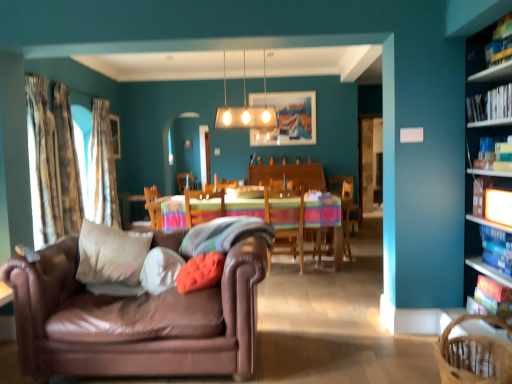
Measure the distance between white soft cushion at center, which is the 1th pillow from left to right, and camera.

white soft cushion at center, which is the 1th pillow from left to right, and camera are 2.65 meters apart.

Image resolution: width=512 pixels, height=384 pixels. In order to click on wooden chair at center, positioned as the 1th chair in left-to-right order in this screenshot , I will do coord(203,198).

The height and width of the screenshot is (384, 512). What do you see at coordinates (500, 41) in the screenshot?
I see `hardcover book at upper right, the fifth book when ordered from bottom to top` at bounding box center [500, 41].

What are the coordinates of `leather couch at left` in the screenshot? It's located at click(x=135, y=319).

From the image's perspective, relative to hardcover book at right, which appears as the 1th book when ordered from the bottom, is wooden chair at center, positioned as the 1th chair in left-to-right order, above or below?

wooden chair at center, positioned as the 1th chair in left-to-right order, is situated higher than hardcover book at right, which appears as the 1th book when ordered from the bottom, in the image.

Visually, is wooden chair at center, positioned as the 1th chair in left-to-right order, positioned to the left or to the right of hardcover book at right, the fifth book when ordered from top to bottom?

wooden chair at center, positioned as the 1th chair in left-to-right order, is positioned on hardcover book at right, the fifth book when ordered from top to bottom,'s left side.

Is the surface of wooden chair at center, positioned as the 1th chair in left-to-right order, in direct contact with hardcover book at right, the fifth book when ordered from top to bottom?

They are not placed beside each other.

In the image, is wooden table with striped cloth at center on the left side or the right side of white glossy rectangular light fixture at upper center?

wooden table with striped cloth at center is to the right of white glossy rectangular light fixture at upper center.

The image size is (512, 384). I want to click on kitchen & dining room table in front of the white glossy rectangular light fixture at upper center, so click(326, 220).

Who is taller, wooden table with striped cloth at center or white glossy rectangular light fixture at upper center?

white glossy rectangular light fixture at upper center.

Which is behind, point (308, 199) or point (273, 111)?

Point (273, 111)

From the image's perspective, would you say hardcover book at right, which appears as the 1th book when ordered from the bottom, is positioned over textured beige curtain at left, the 1th curtain viewed from the front?

No, from the image's perspective, hardcover book at right, which appears as the 1th book when ordered from the bottom, is not over textured beige curtain at left, the 1th curtain viewed from the front.

The height and width of the screenshot is (384, 512). There is a textured beige curtain at left, the 1th curtain viewed from the front. In order to click on the 3rd book below it (from a real-world perspective) in this screenshot , I will do `click(493, 299)`.

From a real-world perspective, is hardcover book at right, the fifth book when ordered from top to bottom, located beneath textured beige curtain at left, the 3th curtain viewed from the back?

Yes.

Is hardcover book at right, the fifth book when ordered from top to bottom, taller than textured beige curtain at left, the 1th curtain viewed from the front?

No.

Can you confirm if white soft pillow at center, positioned as the third pillow in right-to-left order, is taller than hardcover book at right, which appears as the 1th book when ordered from the bottom?

Incorrect, the height of white soft pillow at center, positioned as the third pillow in right-to-left order, is not larger of that of hardcover book at right, which appears as the 1th book when ordered from the bottom.

Which point is more forward, [172,256] or [511,306]?

Positioned in front is point [511,306].

From the picture: From a real-world perspective, which object stands above the other?

white soft pillow at center, positioned as the third pillow in right-to-left order.

Where is `kitchen & dining room table lying below the wooden chair at center, which is the second chair in left-to-right order (from the image's perspective)`? This screenshot has width=512, height=384. kitchen & dining room table lying below the wooden chair at center, which is the second chair in left-to-right order (from the image's perspective) is located at coordinates (326, 220).

From the picture: Choose the correct answer: Is wooden chair at center, which is the 1th chair in right-to-left order, inside wooden table with striped cloth at center or outside it?

wooden chair at center, which is the 1th chair in right-to-left order, is spatially positioned inside wooden table with striped cloth at center.

From a real-world perspective, who is located lower, wooden chair at center, which is the 1th chair in right-to-left order, or wooden table with striped cloth at center?

wooden table with striped cloth at center is physically lower.

Is point (298, 242) positioned behind point (206, 201)?

Yes.

Who is taller, hardcover book at right, which appears as the 1th book when ordered from the bottom, or patterned fabric curtain at left, which is the 1th curtain from back to front?

Standing taller between the two is patterned fabric curtain at left, which is the 1th curtain from back to front.

Is hardcover book at right, which appears as the 1th book when ordered from the bottom, not inside patterned fabric curtain at left, which is the 1th curtain from back to front?

Indeed, hardcover book at right, which appears as the 1th book when ordered from the bottom, is completely outside patterned fabric curtain at left, which is the 1th curtain from back to front.

From the image's perspective, relative to patterned fabric curtain at left, acting as the third curtain starting from the front, is hardcover book at right, the fifth book when ordered from top to bottom, above or below?

hardcover book at right, the fifth book when ordered from top to bottom, is below patterned fabric curtain at left, acting as the third curtain starting from the front.

Is patterned fabric curtain at left, which is the 1th curtain from back to front, inside or outside of wooden table with striped cloth at center?

patterned fabric curtain at left, which is the 1th curtain from back to front, is not enclosed by wooden table with striped cloth at center.

Considering the points (95, 118) and (210, 215), which point is behind, point (95, 118) or point (210, 215)?

The point (95, 118) is behind.

Does patterned fabric curtain at left, which is the 1th curtain from back to front, have a greater width compared to wooden table with striped cloth at center?

No.

Consider the image. From the image's perspective, which one is positioned higher, patterned fabric curtain at left, which is the 1th curtain from back to front, or wooden table with striped cloth at center?

patterned fabric curtain at left, which is the 1th curtain from back to front, is shown above in the image.

Find the location of `the 2nd chair behind the hardcover book at right, which appears as the 1th book when ordered from the bottom`. the 2nd chair behind the hardcover book at right, which appears as the 1th book when ordered from the bottom is located at coordinates (203, 198).

In order to click on kitchen & dining room table that is under the white glossy rectangular light fixture at upper center (from a real-world perspective) in this screenshot , I will do `click(326, 220)`.

Estimate the real-world distances between objects in this image. Which object is closer to hardcover book at upper right, the fifth book when ordered from bottom to top, white soft pillow at center, marked as the 2th pillow in a left-to-right arrangement, or wooden chair at center, which is the second chair in left-to-right order?

white soft pillow at center, marked as the 2th pillow in a left-to-right arrangement, is positioned closer to the anchor hardcover book at upper right, the fifth book when ordered from bottom to top.

Based on their spatial positions, is wooden bookcase at right or brown woven basket at lower right further from hardcover book at upper right, acting as the 3th book starting from the bottom?

Among the two, brown woven basket at lower right is located further to hardcover book at upper right, acting as the 3th book starting from the bottom.

When comparing their distances from hardcover book at upper right, acting as the 3th book starting from the bottom, does white soft pillow at center, marked as the 2th pillow in a left-to-right arrangement, or leather couch at left seem closer?

The object closer to hardcover book at upper right, acting as the 3th book starting from the bottom, is white soft pillow at center, marked as the 2th pillow in a left-to-right arrangement.

When comparing their distances from hardcover book at upper right, arranged as the 2th book when viewed from the top, does velvety orange pillow at center, positioned as the first pillow in right-to-left order, or wooden table with striped cloth at center seem closer?

The object closer to hardcover book at upper right, arranged as the 2th book when viewed from the top, is velvety orange pillow at center, positioned as the first pillow in right-to-left order.

From the image, which object appears to be farther from patterned fabric curtain at left, acting as the third curtain starting from the front, white glossy rectangular light fixture at upper center or hardcover book at right, the fifth book when ordered from top to bottom?

hardcover book at right, the fifth book when ordered from top to bottom.

When comparing their distances from hardcover book at upper right, placed as the third book when sorted from top to bottom, does brown woven basket at lower right or white soft cushion at center, the fourth pillow when ordered from right to left, seem further?

white soft cushion at center, the fourth pillow when ordered from right to left.

Considering their positions, is hardcover book at right, which appears as the 1th book when ordered from the bottom, positioned further to hardcover book at upper right, the fifth book when ordered from bottom to top, than wooden table with striped cloth at center?

wooden table with striped cloth at center is positioned further to the anchor hardcover book at upper right, the fifth book when ordered from bottom to top.

From the image, which object appears to be nearer to white soft cushion at center, the fourth pillow when ordered from right to left, hardcover book at right, marked as the second book in a bottom-to-top arrangement, or hardcover book at upper right, the fifth book when ordered from bottom to top?

Among the two, hardcover book at right, marked as the second book in a bottom-to-top arrangement, is located nearer to white soft cushion at center, the fourth pillow when ordered from right to left.

The height and width of the screenshot is (384, 512). Find the location of `chair between patterned fabric curtain at left, which is the 1th curtain from back to front, and wooden table with striped cloth at center`. chair between patterned fabric curtain at left, which is the 1th curtain from back to front, and wooden table with striped cloth at center is located at coordinates [203, 198].

The width and height of the screenshot is (512, 384). In order to click on book between hardcover book at upper right, which ranks as the first book in top-to-bottom order, and hardcover book at upper right, placed as the third book when sorted from top to bottom, in the vertical direction in this screenshot , I will do `click(490, 104)`.

Find the location of a particular element. The width and height of the screenshot is (512, 384). basket between white soft cushion at center, which is the 1th pillow from left to right, and hardcover book at upper right, acting as the 3th book starting from the bottom, in the horizontal direction is located at coordinates (474, 355).

Where is `lamp located between white soft cushion at center, the fourth pillow when ordered from right to left, and textured beige curtain at left, which is the second curtain from back to front, in the depth direction`? Image resolution: width=512 pixels, height=384 pixels. lamp located between white soft cushion at center, the fourth pillow when ordered from right to left, and textured beige curtain at left, which is the second curtain from back to front, in the depth direction is located at coordinates (246, 109).